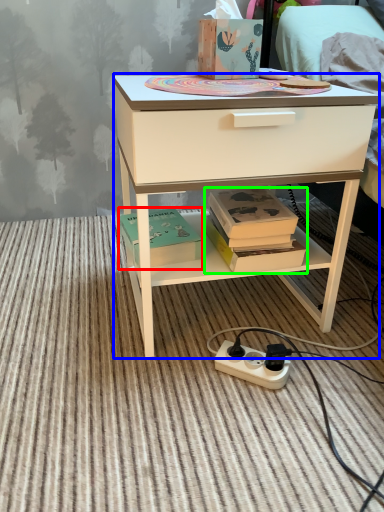
Question: Based on their relative distances, which object is nearer to box (highlighted by a red box)? Choose from desk (highlighted by a blue box) and book (highlighted by a green box).

Choices:
 (A) desk
 (B) book

Answer: (B)